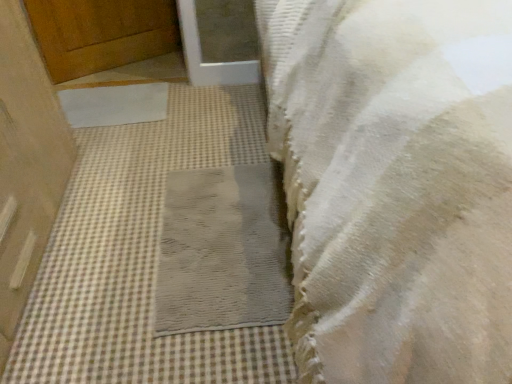
This screenshot has width=512, height=384. I want to click on white textured towel at lower right, so click(395, 185).

In order to face wooden door at left, which is the second door in top-to-bottom order, should I rotate leftwards or rightwards?

A 35.723 degree turn to the left will do.

What do you see at coordinates (26, 162) in the screenshot? I see `wooden door at left, which is the second door in top-to-bottom order` at bounding box center [26, 162].

Where is `gray textured mat at center, marked as the 1th mat in a right-to-left arrangement`? gray textured mat at center, marked as the 1th mat in a right-to-left arrangement is located at coordinates (223, 251).

Identify the location of white matte mat at center, the first mat positioned from the left. (114, 104).

At what (x,y) coordinates should I click in order to perform the action: click on wooden door at upper left, the 2th door positioned from the front. Please return your answer as a coordinate pair (x, y). Looking at the image, I should click on (101, 33).

Does wooden door at left, acting as the first door starting from the front, turn towards white textured towel at lower right?

Yes, wooden door at left, acting as the first door starting from the front, is turned towards white textured towel at lower right.

Does wooden door at left, which is the second door in top-to-bottom order, have a lesser height compared to white textured towel at lower right?

Correct, wooden door at left, which is the second door in top-to-bottom order, is not as tall as white textured towel at lower right.

From a real-world perspective, is wooden door at left, which is the second door in top-to-bottom order, positioned above or below white textured towel at lower right?

Clearly, from a real-world perspective, wooden door at left, which is the second door in top-to-bottom order, is below white textured towel at lower right.

In the image, is wooden door at upper left, which is the first door from top to bottom, on the left side or the right side of white matte mat at center, the first mat positioned from the left?

From the image, it's evident that wooden door at upper left, which is the first door from top to bottom, is to the left of white matte mat at center, the first mat positioned from the left.

Which of these two, wooden door at upper left, which appears as the 1th door when viewed from the back, or white matte mat at center, the 2th mat in the front-to-back sequence, is bigger?

wooden door at upper left, which appears as the 1th door when viewed from the back.

Could white matte mat at center, arranged as the 1th mat when viewed from the top, be considered to be inside wooden door at upper left, the 2th door positioned from the front?

No, wooden door at upper left, the 2th door positioned from the front, does not contain white matte mat at center, arranged as the 1th mat when viewed from the top.

Which object is closer to the camera, wooden door at upper left, which is the first door from top to bottom, or white matte mat at center, marked as the 1th mat in a back-to-front arrangement?

white matte mat at center, marked as the 1th mat in a back-to-front arrangement, is in front.

Which object is thinner, white textured towel at lower right or gray textured mat at center, which is the 2th mat from top to bottom?

Thinner between the two is gray textured mat at center, which is the 2th mat from top to bottom.

Considering the positions of objects white textured towel at lower right and gray textured mat at center, positioned as the first mat in front-to-back order, in the image provided, who is in front, white textured towel at lower right or gray textured mat at center, positioned as the first mat in front-to-back order,?

white textured towel at lower right is more forward.

From the image's perspective, which one is positioned higher, white textured towel at lower right or gray textured mat at center, placed as the 2th mat when sorted from left to right?

white textured towel at lower right.

How different are the orientations of white textured towel at lower right and gray textured mat at center, the 2th mat in the back-to-front sequence, in degrees?

white textured towel at lower right and gray textured mat at center, the 2th mat in the back-to-front sequence, are facing 86.9 degrees away from each other.

I want to click on mat that is the 1st object directly below the wooden door at left, acting as the first door starting from the front (from a real-world perspective), so click(x=114, y=104).

Is wooden door at left, acting as the first door starting from the front, to the right of white matte mat at center, marked as the 1th mat in a back-to-front arrangement, from the viewer's perspective?

No, wooden door at left, acting as the first door starting from the front, is not to the right of white matte mat at center, marked as the 1th mat in a back-to-front arrangement.

Can you confirm if wooden door at left, acting as the 2th door starting from the back, is bigger than white matte mat at center, the 2th mat in the front-to-back sequence?

Correct, wooden door at left, acting as the 2th door starting from the back, is larger in size than white matte mat at center, the 2th mat in the front-to-back sequence.

Is wooden door at left, acting as the first door starting from the front, turned away from white matte mat at center, marked as the 1th mat in a back-to-front arrangement?

No.

In the scene shown: Can you confirm if wooden door at upper left, the 2th door positioned from the front, is positioned to the right of white textured towel at lower right?

Incorrect, wooden door at upper left, the 2th door positioned from the front, is not on the right side of white textured towel at lower right.

Is wooden door at upper left, which appears as the 1th door when viewed from the back, shorter than white textured towel at lower right?

Yes.

Where is `the 1st door to the left of the white textured towel at lower right, starting your count from the anchor`? This screenshot has height=384, width=512. the 1st door to the left of the white textured towel at lower right, starting your count from the anchor is located at coordinates (101, 33).

Is white matte mat at center, the first mat positioned from the left, oriented towards wooden door at upper left, the 2th door positioned from the front?

No, white matte mat at center, the first mat positioned from the left, is not turned towards wooden door at upper left, the 2th door positioned from the front.

Consider the image. Is wooden door at upper left, which is the first door from top to bottom, completely or partially inside white matte mat at center, marked as the 1th mat in a back-to-front arrangement?

That's incorrect, wooden door at upper left, which is the first door from top to bottom, is not inside white matte mat at center, marked as the 1th mat in a back-to-front arrangement.

At what (x,y) coordinates should I click in order to perform the action: click on mat that is the 1st one when counting downward from the wooden door at upper left, the second door positioned from the bottom (from the image's perspective). Please return your answer as a coordinate pair (x, y). The height and width of the screenshot is (384, 512). Looking at the image, I should click on (114, 104).

Is white matte mat at center, the second mat in the right-to-left sequence, taller or shorter than wooden door at upper left, which is the first door from top to bottom?

Clearly, white matte mat at center, the second mat in the right-to-left sequence, is shorter compared to wooden door at upper left, which is the first door from top to bottom.

How much distance is there between gray textured mat at center, positioned as the first mat in front-to-back order, and white matte mat at center, the 2th mat in the bottom-to-top sequence?

gray textured mat at center, positioned as the first mat in front-to-back order, and white matte mat at center, the 2th mat in the bottom-to-top sequence, are 34.15 inches apart.

In the image, is gray textured mat at center, the first mat from the bottom, positioned in front of or behind white matte mat at center, the second mat in the right-to-left sequence?

Clearly, gray textured mat at center, the first mat from the bottom, is in front of white matte mat at center, the second mat in the right-to-left sequence.

Which of these two, gray textured mat at center, placed as the 2th mat when sorted from left to right, or white matte mat at center, arranged as the 1th mat when viewed from the top, is wider?

gray textured mat at center, placed as the 2th mat when sorted from left to right, is wider.

Which of these two, gray textured mat at center, placed as the 2th mat when sorted from left to right, or white matte mat at center, arranged as the 1th mat when viewed from the top, stands taller?

With more height is white matte mat at center, arranged as the 1th mat when viewed from the top.

Identify the location of towel on the right of wooden door at left, acting as the first door starting from the front. click(x=395, y=185).

Identify the location of door beneath the white matte mat at center, the second mat in the right-to-left sequence (from a real-world perspective). The image size is (512, 384). (101, 33).

Based on the photo, when comparing their distances from wooden door at left, acting as the 2th door starting from the back, does white matte mat at center, marked as the 1th mat in a back-to-front arrangement, or white textured towel at lower right seem closer?

white matte mat at center, marked as the 1th mat in a back-to-front arrangement.

In the scene shown: Based on their spatial positions, is wooden door at left, which is the second door in top-to-bottom order, or gray textured mat at center, marked as the 1th mat in a right-to-left arrangement, further from white textured towel at lower right?

The object further to white textured towel at lower right is wooden door at left, which is the second door in top-to-bottom order.

Considering their positions, is wooden door at left, acting as the 2th door starting from the back, positioned closer to white textured towel at lower right than wooden door at upper left, which appears as the 1th door when viewed from the back?

wooden door at left, acting as the 2th door starting from the back, is closer to white textured towel at lower right.

Considering their positions, is white textured towel at lower right positioned further to gray textured mat at center, positioned as the first mat in front-to-back order, than white matte mat at center, marked as the 1th mat in a back-to-front arrangement?

Among the two, white matte mat at center, marked as the 1th mat in a back-to-front arrangement, is located further to gray textured mat at center, positioned as the first mat in front-to-back order.

When comparing their distances from white textured towel at lower right, does gray textured mat at center, the first mat from the bottom, or wooden door at left, acting as the 2th door starting from the back, seem closer?

gray textured mat at center, the first mat from the bottom, lies closer to white textured towel at lower right than the other object.

Based on their spatial positions, is gray textured mat at center, placed as the 2th mat when sorted from left to right, or wooden door at upper left, the second door positioned from the bottom, further from white textured towel at lower right?

Based on the image, wooden door at upper left, the second door positioned from the bottom, appears to be further to white textured towel at lower right.

Which object lies further to the anchor point wooden door at left, which is the second door in top-to-bottom order, gray textured mat at center, positioned as the first mat in front-to-back order, or white textured towel at lower right?

The object further to wooden door at left, which is the second door in top-to-bottom order, is white textured towel at lower right.

Which object lies further to the anchor point wooden door at left, acting as the 2th door starting from the back, white matte mat at center, the first mat positioned from the left, or wooden door at upper left, which is the first door from top to bottom?

wooden door at upper left, which is the first door from top to bottom, is positioned further to the anchor wooden door at left, acting as the 2th door starting from the back.

Identify the location of mat between wooden door at left, acting as the 2th door starting from the back, and white matte mat at center, arranged as the 1th mat when viewed from the top, from front to back. (223, 251).

Find the location of `door between white textured towel at lower right and wooden door at upper left, the 2th door positioned from the front, in the front-back direction`. door between white textured towel at lower right and wooden door at upper left, the 2th door positioned from the front, in the front-back direction is located at coordinates (26, 162).

Locate an element on the screen. The height and width of the screenshot is (384, 512). mat between white textured towel at lower right and white matte mat at center, the 2th mat in the front-to-back sequence, in the front-back direction is located at coordinates (223, 251).

You are a GUI agent. You are given a task and a screenshot of the screen. Output one action in this format:
    pyautogui.click(x=<x>, y=<y>)
    Task: Click on the door between white textured towel at lower right and white matte mat at center, the second mat in the right-to-left sequence, in the front-back direction
    The height and width of the screenshot is (384, 512).
    Given the screenshot: What is the action you would take?
    pyautogui.click(x=26, y=162)